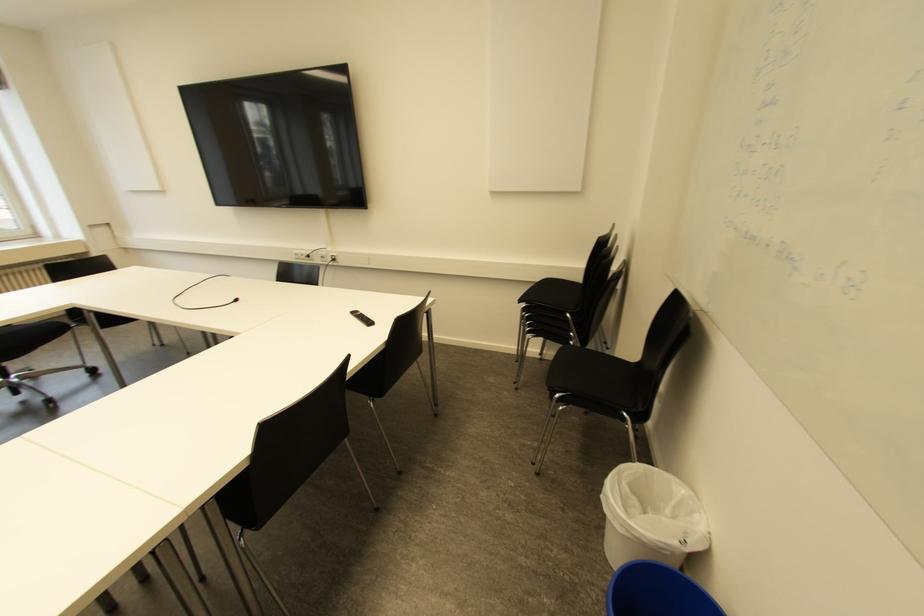
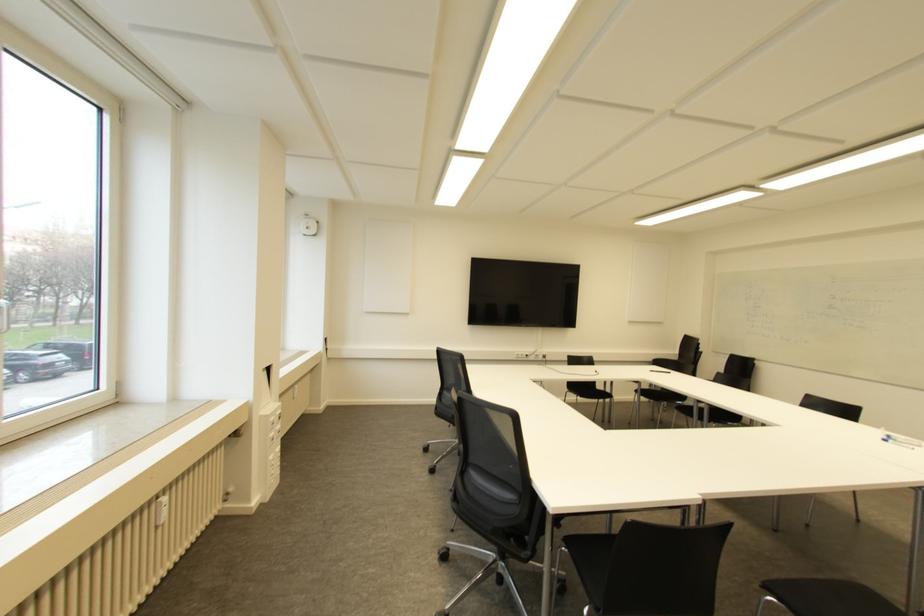
Where in the second image is the point corresponding to point (334, 259) from the first image?

(543, 355)